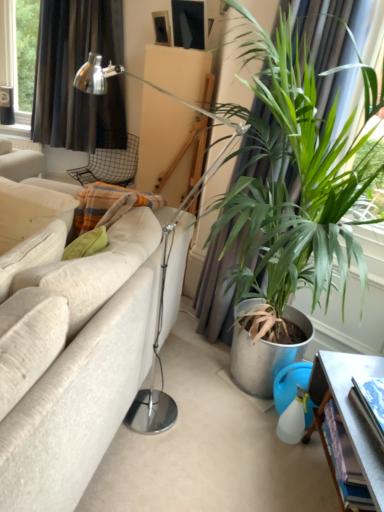
Question: From the image's perspective, relative to black fabric curtain at upper left, is metal mesh chair at upper center above or below?

Choices:
 (A) below
 (B) above

Answer: (A)

Question: Considering their positions, is metal mesh chair at upper center located in front of or behind black fabric curtain at upper left?

Choices:
 (A) front
 (B) behind

Answer: (B)

Question: Estimate the real-world distances between objects in this image. Which object is closer to the metallic gray table at lower right?

Choices:
 (A) metal mesh chair at upper center
 (B) white fabric couch at left
 (C) green leafy plant at right
 (D) black fabric curtain at upper left
 (E) matte black picture frame at upper center

Answer: (C)

Question: Which object is positioned farthest from the metallic gray table at lower right?

Choices:
 (A) white fabric couch at left
 (B) green leafy plant at right
 (C) black fabric curtain at upper left
 (D) metal mesh chair at upper center
 (E) matte black picture frame at upper center

Answer: (C)